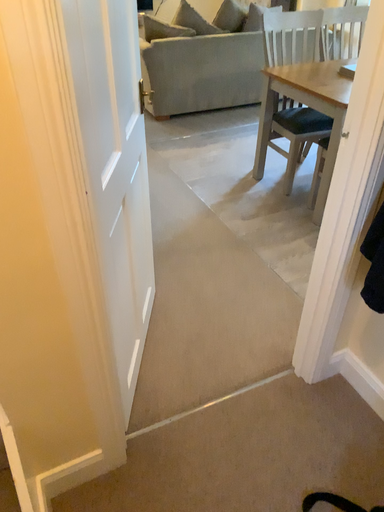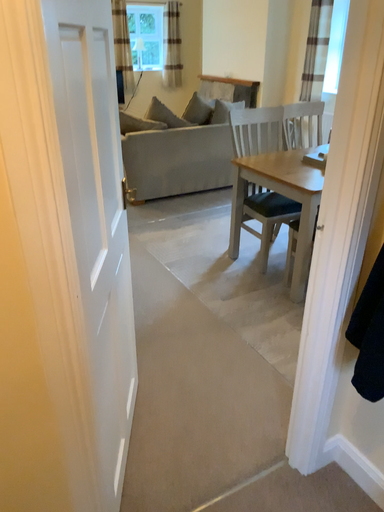
Question: Which way did the camera rotate in the video?

Choices:
 (A) rotated upward
 (B) rotated downward

Answer: (A)